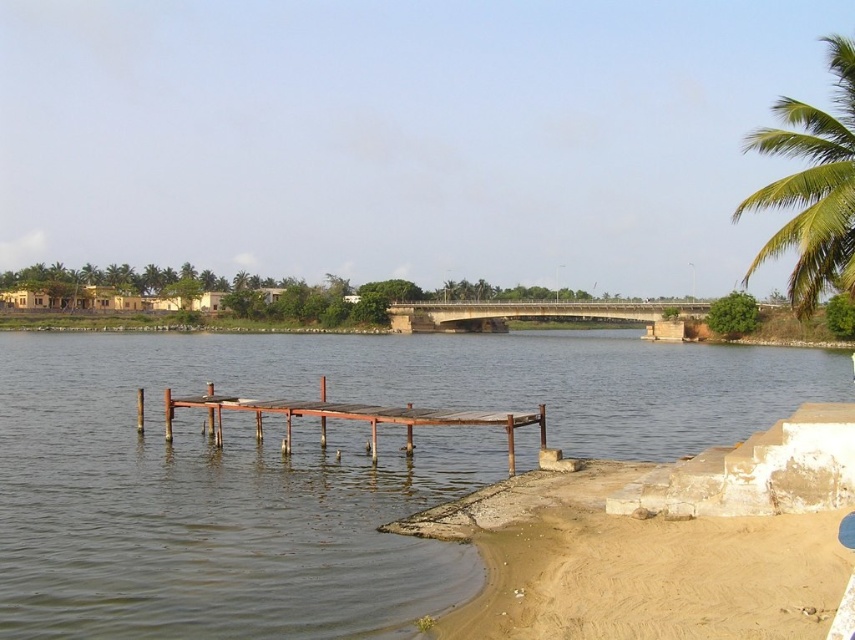
You are standing at the center of the image and want to walk to the brown sandy beach at lower right. Which direction should you move in?

To reach the brown sandy beach at lower right, you should move towards the lower right direction from the center of the image.

You are standing on the rusty wood dock at center and want to see if you can reach the green leafy palm tree at upper right without moving. Which direction should you look to see the palm tree?

You should look towards the upper right direction to see the green leafy palm tree at upper right, as it is located at upper right relative to the rusty wood dock at center.